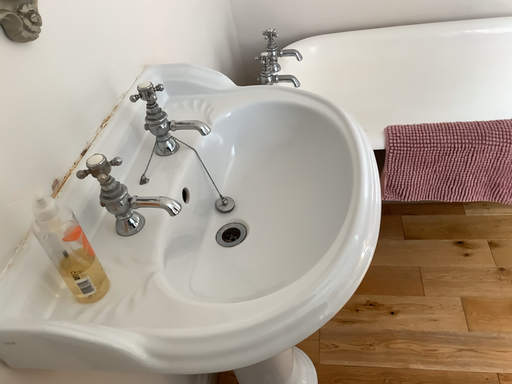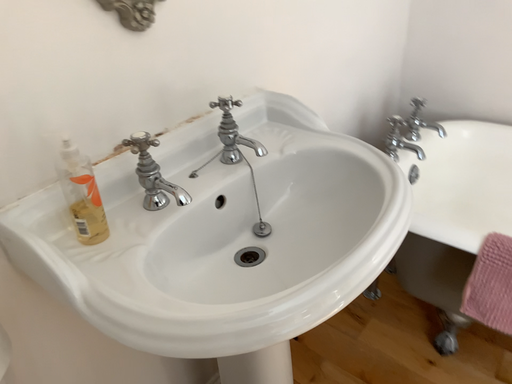
Question: Which way did the camera rotate in the video?

Choices:
 (A) rotated right
 (B) rotated left

Answer: (B)